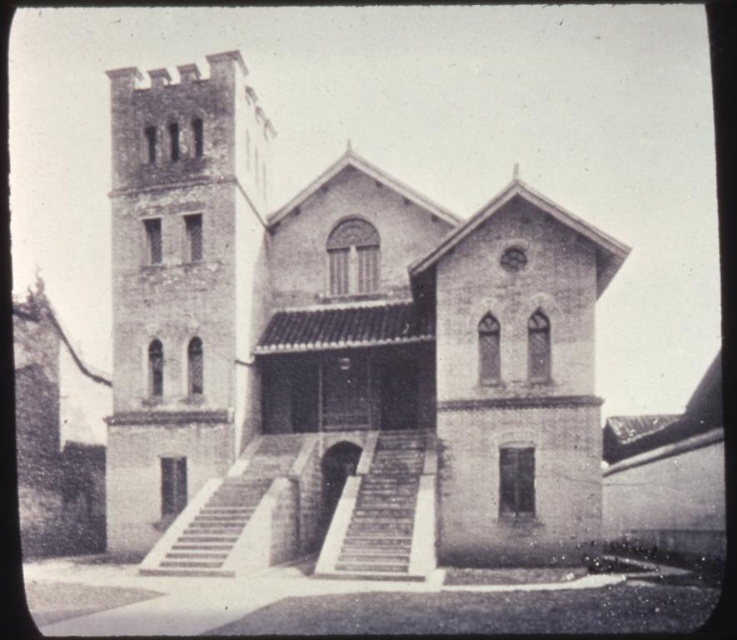
Does stone textured stairs at center lie behind smooth concrete stairs at center?

No, stone textured stairs at center is closer to the viewer.

Can you confirm if stone textured stairs at center is bigger than smooth concrete stairs at center?

Yes.

Which is behind, point (366, 556) or point (175, 541)?

Point (175, 541)

At what (x,y) coordinates should I click in order to perform the action: click on stone textured stairs at center. Please return your answer as a coordinate pair (x, y). Looking at the image, I should click on (384, 512).

Between point (495, 516) and point (189, 520), which one is positioned behind?

The point (495, 516) is more distant.

Where is `brick chapel at center`? brick chapel at center is located at coordinates (342, 348).

Does point (486, 356) lie in front of point (213, 104)?

That is True.

Does brick chapel at center have a greater width compared to brick tower at left?

Yes, brick chapel at center is wider than brick tower at left.

Where is `brick chapel at center`? This screenshot has width=737, height=640. brick chapel at center is located at coordinates (342, 348).